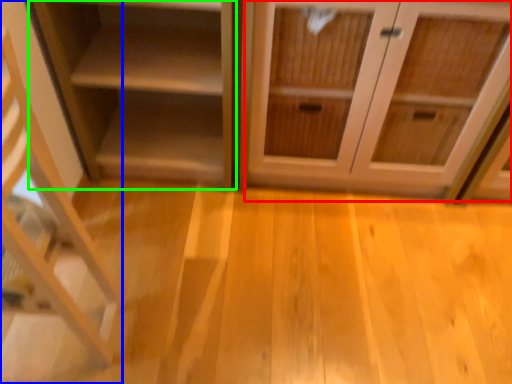
Question: Which object is positioned farthest from cabinetry (highlighted by a red box)? Select from shelf (highlighted by a blue box) and shelf (highlighted by a green box).

Choices:
 (A) shelf
 (B) shelf

Answer: (A)